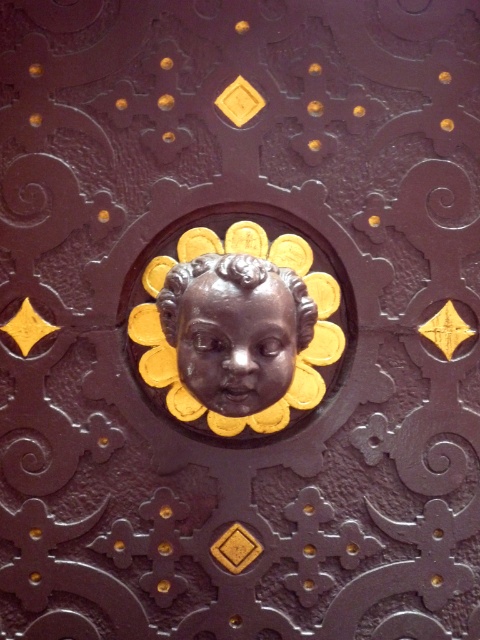
Question: Considering the relative positions of bronze statue at center and matte bronze cherub at center in the image provided, where is bronze statue at center located with respect to matte bronze cherub at center?

Choices:
 (A) below
 (B) above

Answer: (A)

Question: Which point is farther to the camera?

Choices:
 (A) bronze statue at center
 (B) matte bronze cherub at center

Answer: (B)

Question: Is bronze statue at center closer to camera compared to matte bronze cherub at center?

Choices:
 (A) no
 (B) yes

Answer: (B)

Question: Is bronze statue at center above matte bronze cherub at center?

Choices:
 (A) yes
 (B) no

Answer: (B)